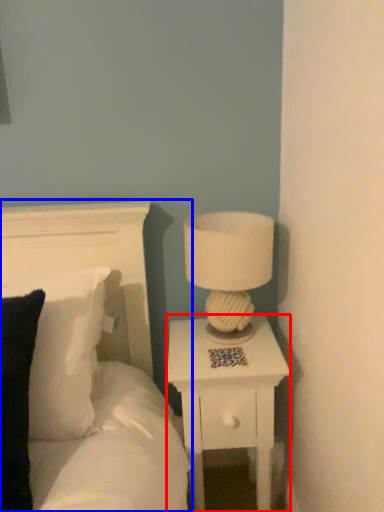
Question: Which object is closer to the camera taking this photo, nightstand (highlighted by a red box) or bed (highlighted by a blue box)?

Choices:
 (A) nightstand
 (B) bed

Answer: (B)